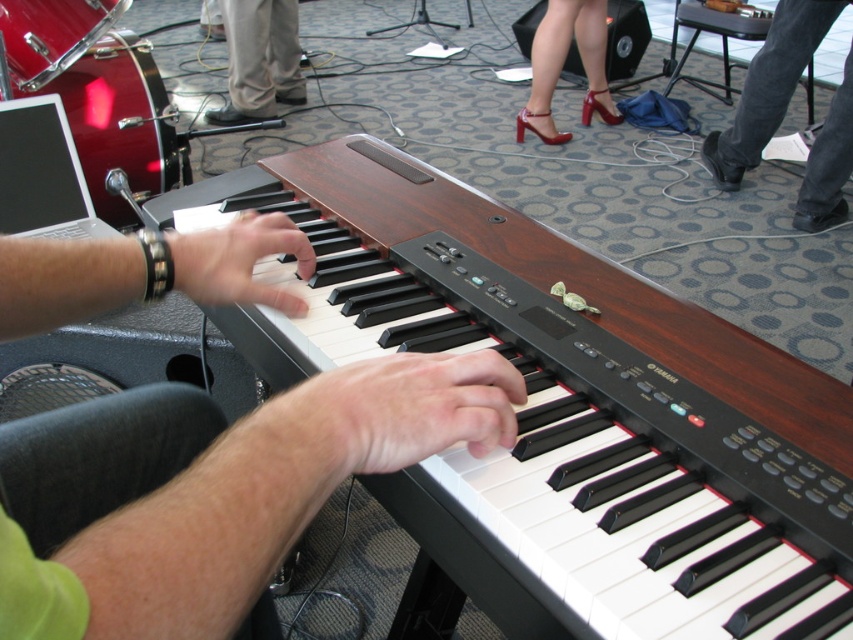
Question: Can you confirm if white matte hand at center is positioned to the left of matte black hand at center?

Choices:
 (A) yes
 (B) no

Answer: (B)

Question: Can you confirm if green fabric pants at center is wider than black leather shoe at lower right?

Choices:
 (A) no
 (B) yes

Answer: (A)

Question: From the image, what is the correct spatial relationship of wooden piano at center in relation to matte black hand at center?

Choices:
 (A) below
 (B) above

Answer: (A)

Question: Which point is closer to the camera?

Choices:
 (A) white matte hand at center
 (B) wooden piano at center
 (C) tan fabric pants at center
 (D) shiny patent leather high heels at upper center

Answer: (B)

Question: Which is farther from the wooden piano at center?

Choices:
 (A) black leather shoe at lower right
 (B) green fabric pants at center

Answer: (A)

Question: Among these objects, which one is nearest to the camera?

Choices:
 (A) wooden piano at center
 (B) white matte hand at center
 (C) black leather shoe at lower right

Answer: (A)